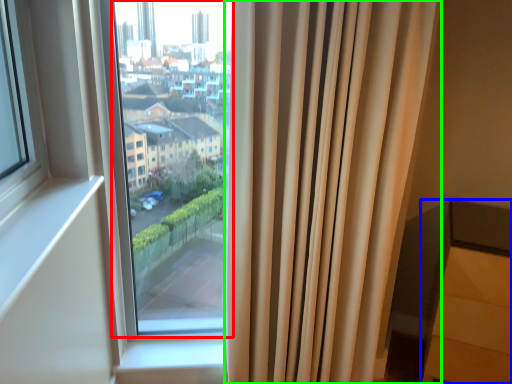
Question: Which object is the farthest from bay window (highlighted by a red box)? Choose among these: furniture (highlighted by a blue box) or curtain (highlighted by a green box).

Choices:
 (A) furniture
 (B) curtain

Answer: (A)